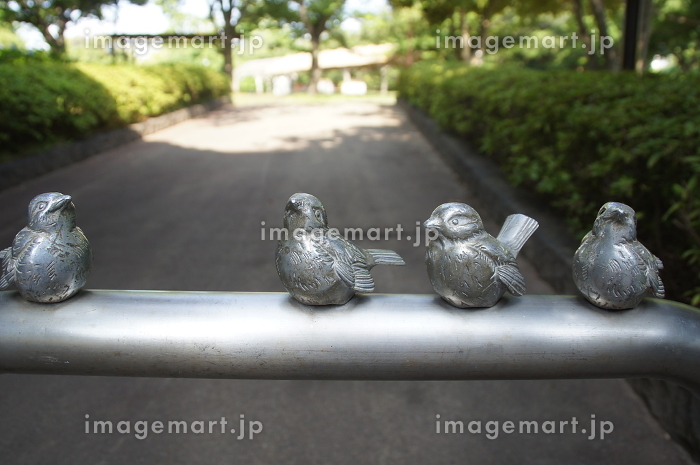
The height and width of the screenshot is (465, 700). I want to click on cover, so click(365, 53).